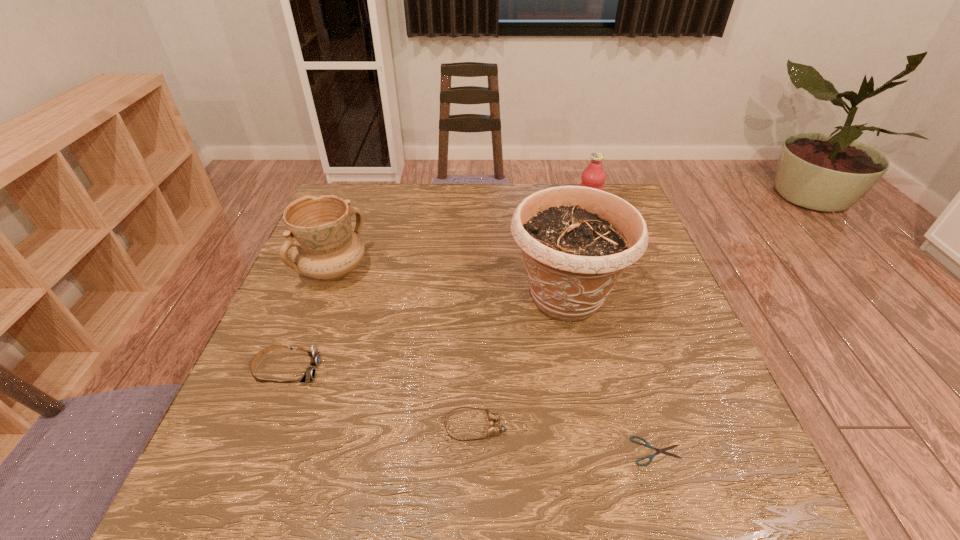
What are the coordinates of `free spot located on the label of the farthest object` in the screenshot? It's located at (501, 218).

Locate an element on the screen. free region located on the label of the farthest object is located at coordinates (555, 218).

This screenshot has width=960, height=540. Identify the location of free space located 0.330m on the front of the pottery. (279, 413).

Locate an element on the screen. The width and height of the screenshot is (960, 540). free region located on the front-facing side of the third shortest object is located at coordinates (447, 370).

The image size is (960, 540). I want to click on vacant space located on the front lenses and sides of the second shortest object, so click(666, 426).

Where is `vacant space located on the back of the shears`? vacant space located on the back of the shears is located at coordinates (620, 333).

You are a GUI agent. You are given a task and a screenshot of the screen. Output one action in this format:
    pyautogui.click(x=<x>, y=<y>)
    Task: Click on the object that is at the far edge
    This screenshot has height=540, width=960.
    Given the screenshot: What is the action you would take?
    point(594,176)

Where is `object that is at the near edge`? object that is at the near edge is located at coordinates (647, 444).

Find the location of a particular element. Image resolution: width=960 pixels, height=540 pixels. pottery present at the left edge is located at coordinates (319, 229).

The image size is (960, 540). Identify the location of goggles situated at the left edge. (310, 373).